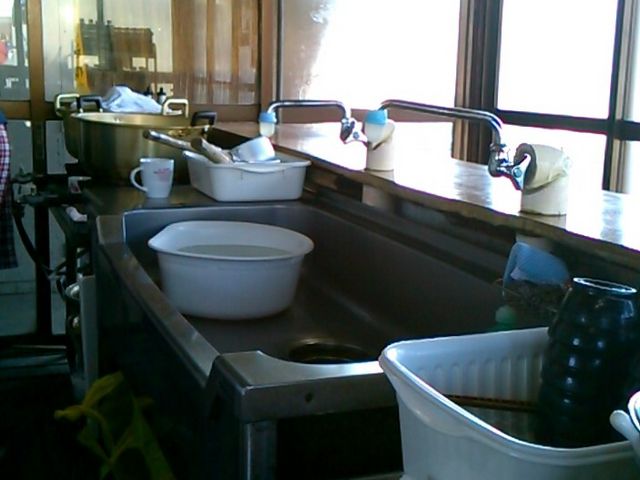
The image size is (640, 480). In order to click on white bowl in this screenshot , I will do `click(253, 148)`.